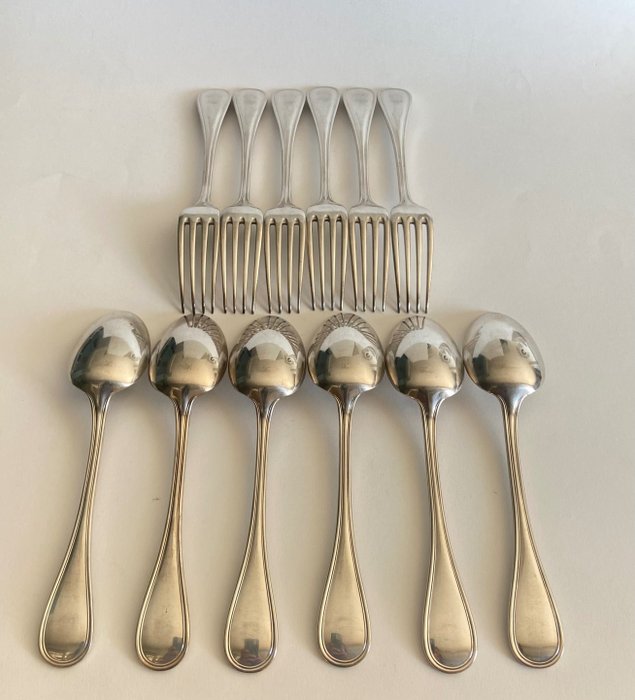
Identify the location of spoon. The width and height of the screenshot is (635, 700). (90, 472), (177, 470), (258, 472), (342, 477), (432, 458), (516, 463).